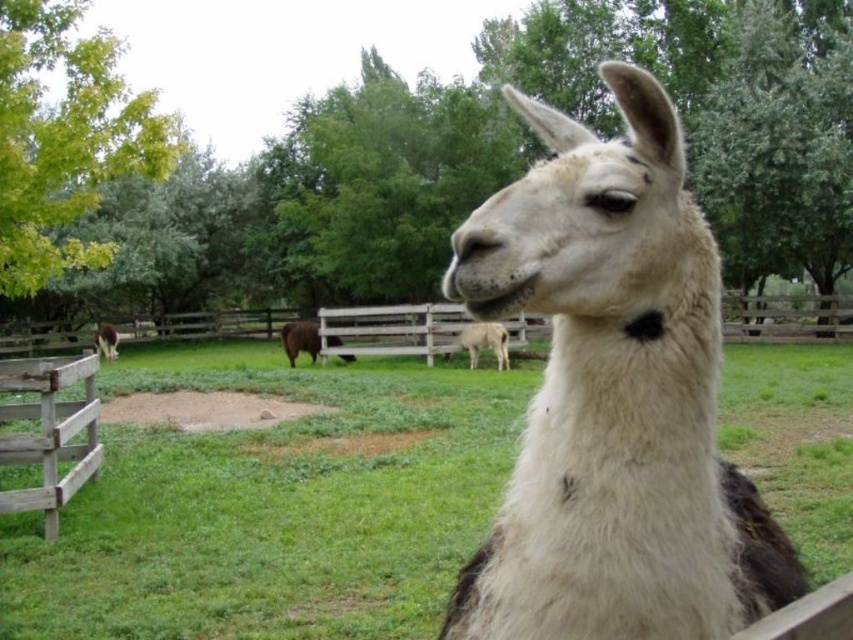
Who is positioned more to the left, white woolen alpaca at center or white woolen goat at center?

white woolen alpaca at center is more to the left.

Is point (633, 134) positioned in front of point (469, 365)?

Yes, point (633, 134) is closer to viewer.

Find the location of a particular element. white woolen alpaca at center is located at coordinates (613, 397).

Identify the location of white woolen alpaca at center. (613, 397).

From the picture: Measure the distance from wooden fence at center to white woolen goat at center.

A distance of 11.18 meters exists between wooden fence at center and white woolen goat at center.

Between wooden fence at center and white woolen goat at center, which one has less height?

With less height is white woolen goat at center.

The height and width of the screenshot is (640, 853). Identify the location of wooden fence at center. (393, 328).

In the scene shown: Does green grass at center have a smaller size compared to white woolen goat at center?

No, green grass at center is not smaller than white woolen goat at center.

From the picture: Can you confirm if green grass at center is positioned to the right of white woolen goat at center?

No, green grass at center is not to the right of white woolen goat at center.

Does point (407, 461) lie behind point (492, 348)?

No, it is in front of (492, 348).

What are the coordinates of `green grass at center` in the screenshot? It's located at (273, 506).